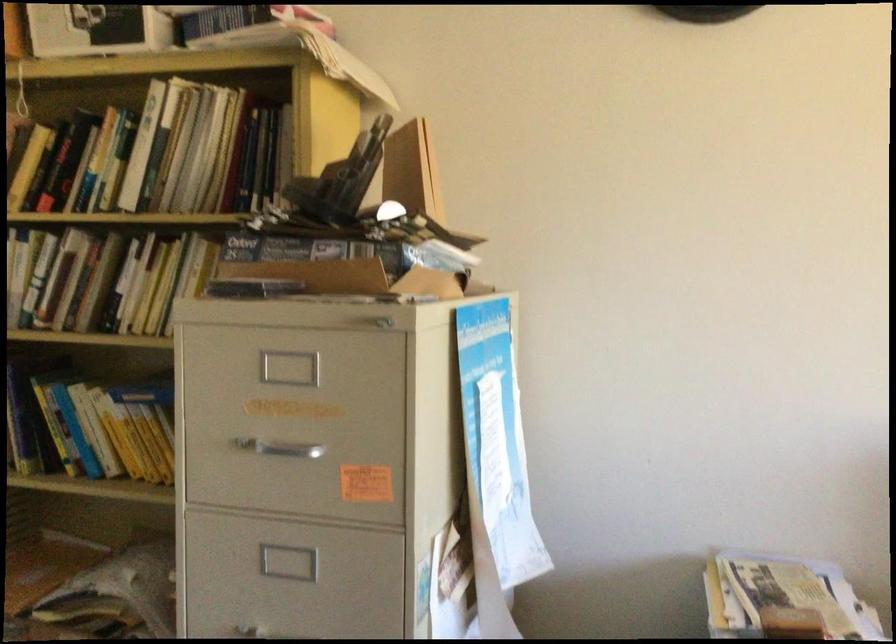
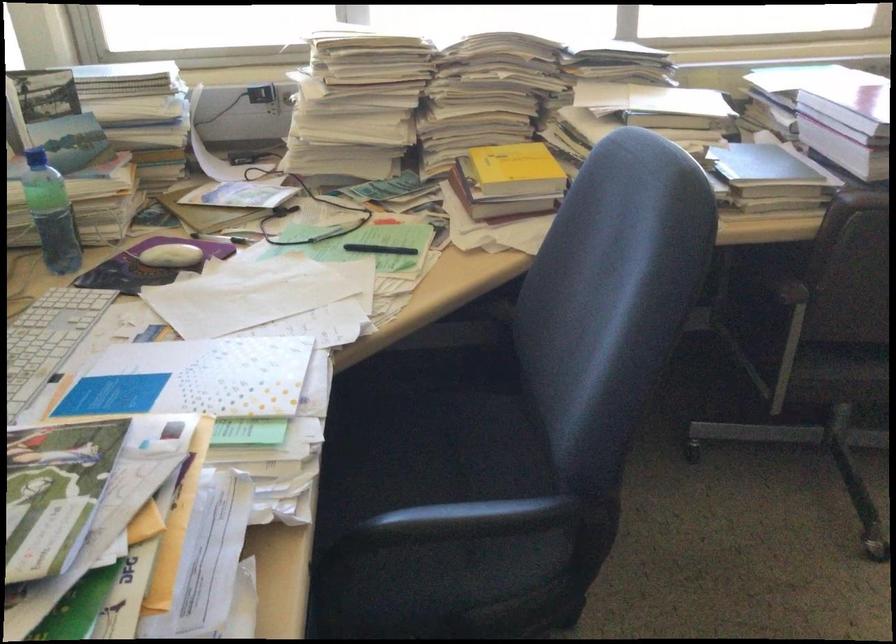
Based on the continuous images, in which direction is the camera rotating?

The rotation direction of the camera is right-down.